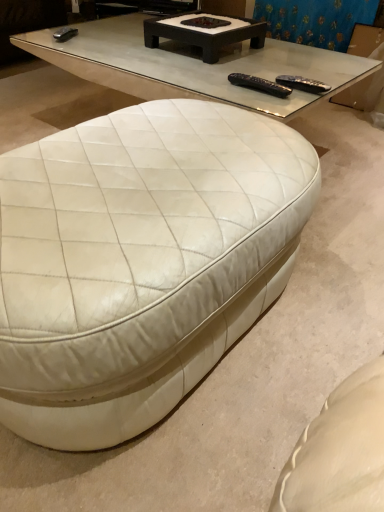
Question: Is white leather ottoman at lower left, placed as the 2th coffee table when sorted from back to front, bigger than blue fabric curtain at upper center?

Choices:
 (A) no
 (B) yes

Answer: (B)

Question: From the image's perspective, would you say white leather ottoman at lower left, which is the 2th coffee table from top to bottom, is shown under blue fabric curtain at upper center?

Choices:
 (A) no
 (B) yes

Answer: (B)

Question: Is white leather ottoman at lower left, which ranks as the 1th coffee table in bottom-to-top order, thinner than blue fabric curtain at upper center?

Choices:
 (A) yes
 (B) no

Answer: (B)

Question: From a real-world perspective, does white leather ottoman at lower left, which ranks as the 1th coffee table in bottom-to-top order, stand above blue fabric curtain at upper center?

Choices:
 (A) yes
 (B) no

Answer: (B)

Question: Can you confirm if white leather ottoman at lower left, the 1th coffee table in the front-to-back sequence, is smaller than blue fabric curtain at upper center?

Choices:
 (A) no
 (B) yes

Answer: (A)

Question: Is white leather ottoman at lower left, placed as the 2th coffee table when sorted from back to front, to the right of blue fabric curtain at upper center from the viewer's perspective?

Choices:
 (A) no
 (B) yes

Answer: (A)

Question: Does black plastic remote at upper center, arranged as the second remote when viewed from the right, have a greater width compared to white leather ottoman at lower left, which ranks as the 1th coffee table in bottom-to-top order?

Choices:
 (A) no
 (B) yes

Answer: (A)

Question: Can we say black plastic remote at upper center, the 1th remote viewed from the left, lies outside white leather ottoman at lower left, the 1th coffee table in the front-to-back sequence?

Choices:
 (A) yes
 (B) no

Answer: (A)

Question: Is black plastic remote at upper center, the 1th remote viewed from the left, surrounding white leather ottoman at lower left, which ranks as the 1th coffee table in bottom-to-top order?

Choices:
 (A) yes
 (B) no

Answer: (B)

Question: Is black plastic remote at upper center, arranged as the second remote when viewed from the right, positioned with its back to white leather ottoman at lower left, which is the 2th coffee table from top to bottom?

Choices:
 (A) no
 (B) yes

Answer: (A)

Question: Is black plastic remote at upper center, arranged as the second remote when viewed from the right, further to the viewer compared to white leather ottoman at lower left, placed as the 2th coffee table when sorted from back to front?

Choices:
 (A) yes
 (B) no

Answer: (A)

Question: Is black plastic remote at upper center, the 1th remote viewed from the left, not close to white leather ottoman at lower left, which is the 2th coffee table from top to bottom?

Choices:
 (A) no
 (B) yes

Answer: (A)

Question: Is white leather ottoman at lower left, which ranks as the 1th coffee table in bottom-to-top order, at the back of blue fabric curtain at upper center?

Choices:
 (A) yes
 (B) no

Answer: (B)